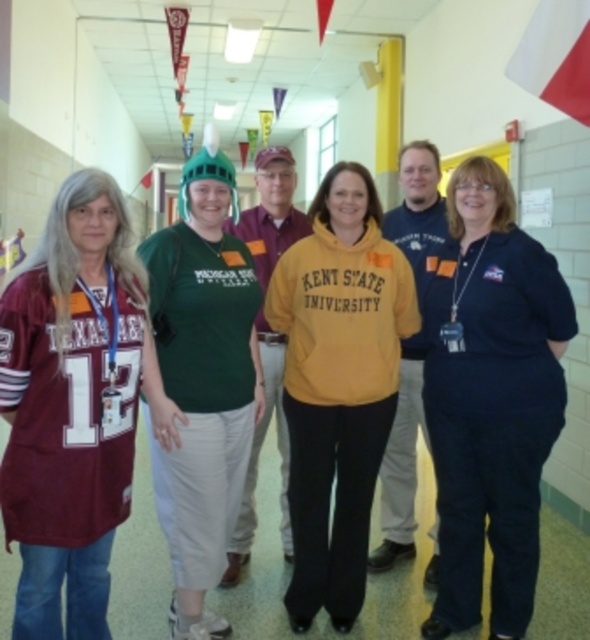
You are a photographer trying to capture a group photo of the navy blue uniform at center and the yellow fleece sweatshirt at center. To ensure both are in frame, should you position the camera to the left or right of the group?

The navy blue uniform at center is to the right of the yellow fleece sweatshirt at center. To include both in the frame, position the camera to the left of the group so that the yellow fleece sweatshirt at center is on the left side and the navy blue uniform at center is on the right side of the photo.

You are standing in the school hallway and want to walk from point A to point B. Point A is at coordinates point (419, 276) and point B is at coordinates point (527, 35). Which direction should you face to walk directly towards point B from point A?

To walk directly from point A to point B, you should face towards the upper left direction since point A is in front of point B.

You are a photographer setting up for a group photo in the hallway. You want to position yourself so that both the yellow fleece at center and the white fabric flag at upper right are visible in your shot. Given their distance apart, what is the minimum focal length lens you should use if your camera has a sensor size of 24mm x 36mm?

The yellow fleece at center and white fabric flag at upper right are 37.98 inches apart. To capture both in frame with a 24mm x 36mm sensor, the minimum focal length required would be approximately 35mm, ensuring the entire distance fits within the camera sensor dimensions.